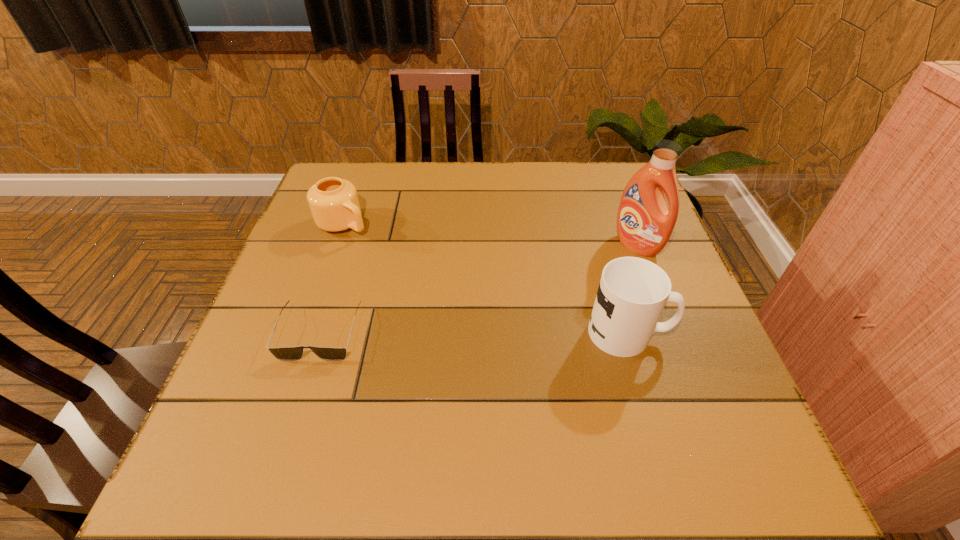
The width and height of the screenshot is (960, 540). What are the coordinates of `vacant space located 0.120m on the front-facing side of the detergent` in the screenshot? It's located at (592, 277).

Where is `free space located on the handle side of the second shortest object`? The image size is (960, 540). free space located on the handle side of the second shortest object is located at coordinates (451, 296).

Find the location of `free space located 0.350m on the handle side of the second shortest object`. free space located 0.350m on the handle side of the second shortest object is located at coordinates (458, 300).

Locate an element on the screen. vacant space located 0.130m on the handle side of the second shortest object is located at coordinates (394, 257).

Identify the location of sunglasses located at the left edge. Image resolution: width=960 pixels, height=540 pixels. (285, 353).

I want to click on mug present at the left edge, so click(334, 204).

Find the location of a particular element. mug at the right edge is located at coordinates (632, 293).

At what (x,y) coordinates should I click in order to perform the action: click on detergent located at the right edge. Please return your answer as a coordinate pair (x, y). Image resolution: width=960 pixels, height=540 pixels. Looking at the image, I should click on (644, 225).

What are the coordinates of `free space at the far edge of the desktop` in the screenshot? It's located at (466, 187).

Where is `vacant space at the near edge of the desktop`? vacant space at the near edge of the desktop is located at coordinates (x=561, y=389).